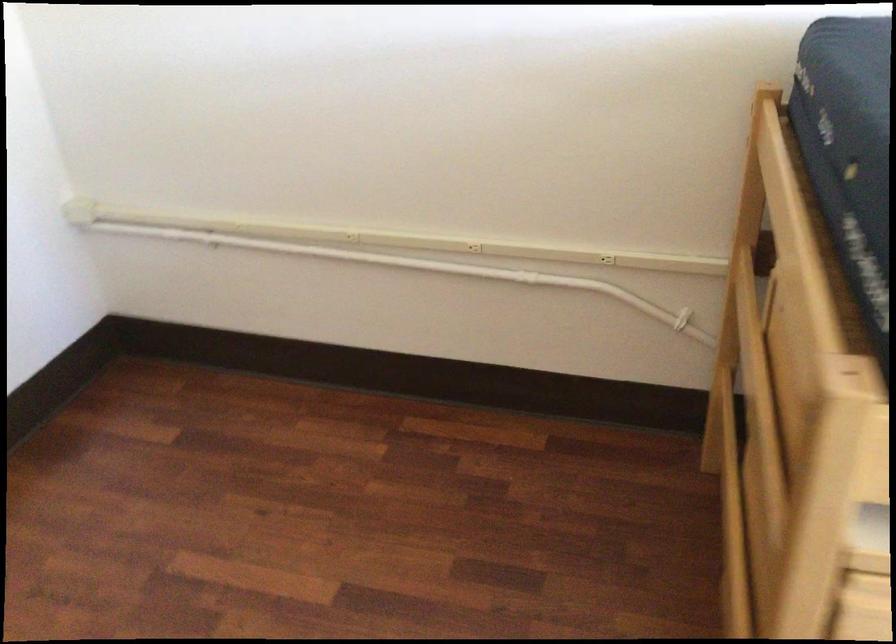
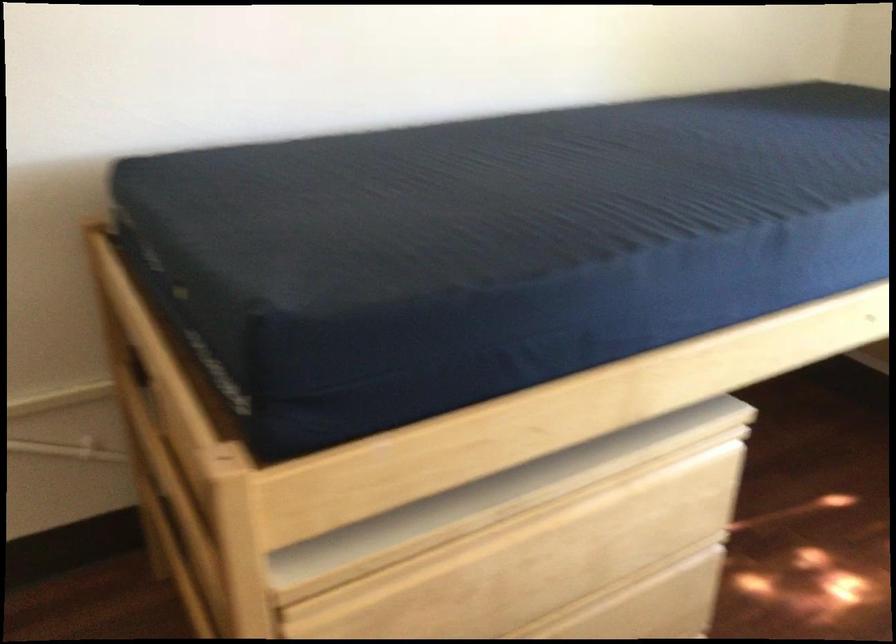
Question: The camera is either moving clockwise (left) or counter-clockwise (right) around the object. The first image is from the beginning of the video and the second image is from the end. Is the camera moving left or right when shooting the video?

Choices:
 (A) Left
 (B) Right

Answer: (A)